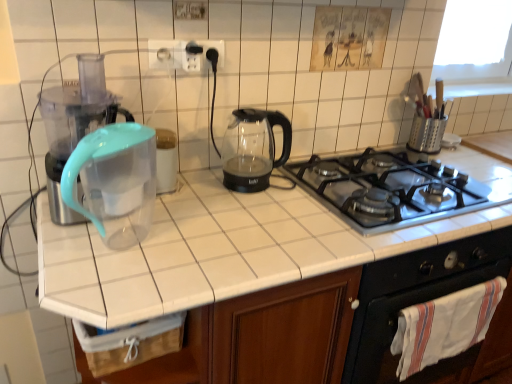
Question: Is transparent plastic water filter pitcher at left thinner than white plastic electric outlet at upper center, which ranks as the second electric outlet in left-to-right order?

Choices:
 (A) yes
 (B) no

Answer: (B)

Question: Is transparent plastic water filter pitcher at left far from white plastic electric outlet at upper center, which ranks as the second electric outlet in left-to-right order?

Choices:
 (A) no
 (B) yes

Answer: (A)

Question: Does transparent plastic water filter pitcher at left come behind white plastic electric outlet at upper center, placed as the first electric outlet when sorted from right to left?

Choices:
 (A) yes
 (B) no

Answer: (B)

Question: Considering the relative sizes of transparent plastic water filter pitcher at left and white plastic electric outlet at upper center, placed as the first electric outlet when sorted from right to left, in the image provided, is transparent plastic water filter pitcher at left shorter than white plastic electric outlet at upper center, placed as the first electric outlet when sorted from right to left,?

Choices:
 (A) no
 (B) yes

Answer: (A)

Question: Considering the relative sizes of transparent plastic water filter pitcher at left and white plastic electric outlet at upper center, which ranks as the second electric outlet in left-to-right order, in the image provided, is transparent plastic water filter pitcher at left wider than white plastic electric outlet at upper center, which ranks as the second electric outlet in left-to-right order,?

Choices:
 (A) no
 (B) yes

Answer: (B)

Question: Considering the relative positions of transparent plastic water filter pitcher at left and white plastic electric outlet at upper center, which ranks as the second electric outlet in left-to-right order, in the image provided, is transparent plastic water filter pitcher at left to the right of white plastic electric outlet at upper center, which ranks as the second electric outlet in left-to-right order, from the viewer's perspective?

Choices:
 (A) yes
 (B) no

Answer: (B)

Question: From the image's perspective, is black matte oven at lower right under white plastic socket at upper center, the 1th electric outlet from the left?

Choices:
 (A) no
 (B) yes

Answer: (B)

Question: Can you confirm if black matte oven at lower right is positioned to the right of white plastic socket at upper center, the 1th electric outlet from the left?

Choices:
 (A) yes
 (B) no

Answer: (A)

Question: Is the depth of black matte oven at lower right less than that of white plastic socket at upper center, the 2th electric outlet when ordered from right to left?

Choices:
 (A) no
 (B) yes

Answer: (B)

Question: Could you tell me if black matte oven at lower right is turned towards white plastic socket at upper center, the 1th electric outlet from the left?

Choices:
 (A) no
 (B) yes

Answer: (A)

Question: From a real-world perspective, is black matte oven at lower right physically above white plastic socket at upper center, the 1th electric outlet from the left?

Choices:
 (A) yes
 (B) no

Answer: (B)

Question: Is black matte oven at lower right smaller than white plastic socket at upper center, the 2th electric outlet when ordered from right to left?

Choices:
 (A) no
 (B) yes

Answer: (A)

Question: Can you see metallic gray gas stove at center touching white plastic electric outlet at upper center, which ranks as the second electric outlet in left-to-right order?

Choices:
 (A) yes
 (B) no

Answer: (B)